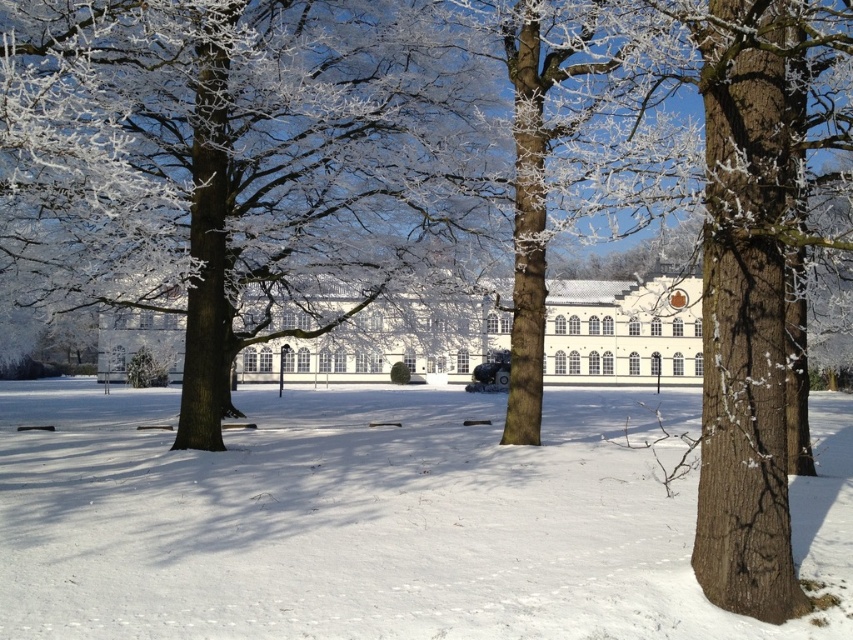
Can you confirm if smooth brown tree trunk at center is positioned below white smooth building at center?

No, smooth brown tree trunk at center is not below white smooth building at center.

Is the position of smooth brown tree trunk at center more distant than that of white smooth building at center?

No, it is in front of white smooth building at center.

Find the location of a particular element. Image resolution: width=853 pixels, height=640 pixels. smooth brown tree trunk at center is located at coordinates (234, 160).

Is point (554, 630) farther from viewer compared to point (401, 348)?

That is False.

Between white powdery snow at center and white smooth building at center, which one is positioned lower?

Positioned lower is white powdery snow at center.

The height and width of the screenshot is (640, 853). Find the location of `white powdery snow at center`. white powdery snow at center is located at coordinates (376, 520).

Which of these two, white powdery snow at center or smooth brown tree trunk at center, stands shorter?

white powdery snow at center

In the scene shown: Who is higher up, white powdery snow at center or smooth brown tree trunk at center?

smooth brown tree trunk at center is higher up.

Does point (149, 636) lie in front of point (131, 246)?

Yes.

The image size is (853, 640). In order to click on white powdery snow at center in this screenshot , I will do `click(376, 520)`.